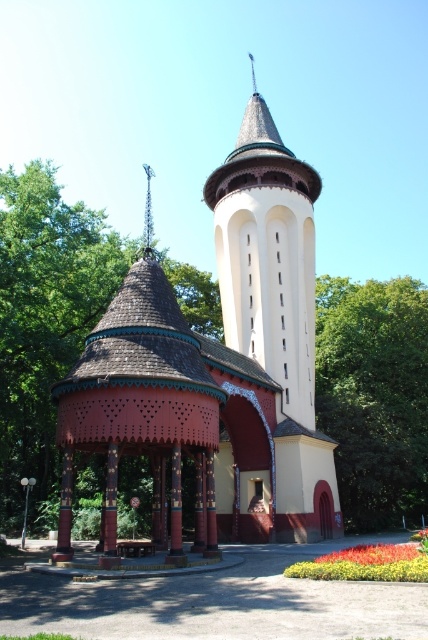
You are a drone operator planning to fly a drone between the green leafy tree at upper center and the white smooth tower at center. The drone has a maximum flight distance of 15 meters. Can the drone safely fly between them without exceeding its range?

The distance between the green leafy tree at upper center and the white smooth tower at center is 17.18 meters, which exceeds the drone operator maximum flight range of 15 meters. Therefore, the drone cannot safely fly between them without exceeding its range.

You are standing at the center of the image and want to find the brown wooden gazebo at left. In which direction should you look to locate it?

The brown wooden gazebo at left is located at point (44,324), which is to the left side of the image. Therefore, you should look to your left to locate it.